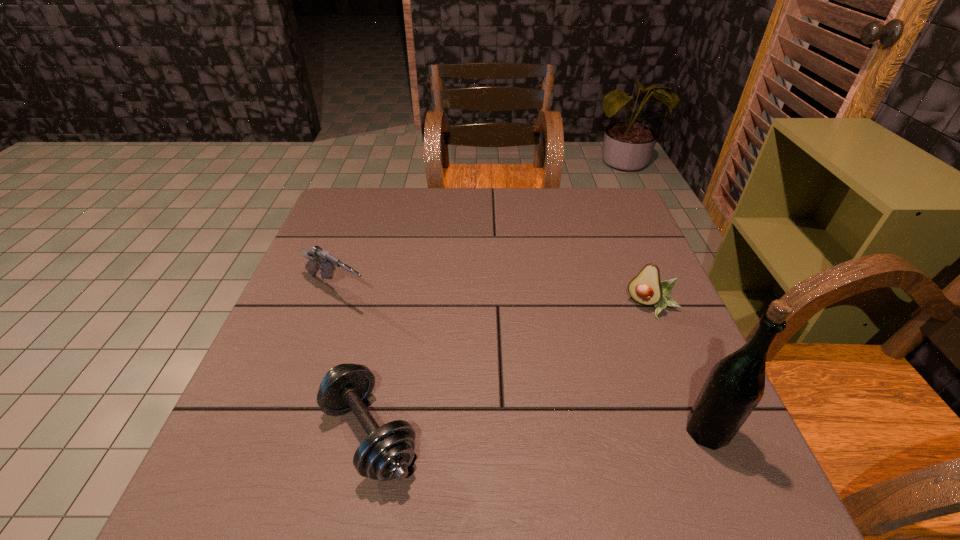
Where is `free region located on the seed side of the avocado`? This screenshot has height=540, width=960. free region located on the seed side of the avocado is located at coordinates (573, 436).

Locate an element on the screen. Image resolution: width=960 pixels, height=540 pixels. free location located 0.340m on the seed side of the avocado is located at coordinates (576, 432).

This screenshot has width=960, height=540. I want to click on dumbbell that is at the near edge, so click(x=385, y=454).

This screenshot has width=960, height=540. I want to click on beer bottle that is at the near edge, so click(x=735, y=385).

This screenshot has width=960, height=540. What are the coordinates of `object located in the left edge section of the desktop` in the screenshot? It's located at (318, 257).

Where is `beer bottle present at the right edge`? beer bottle present at the right edge is located at coordinates (735, 385).

Identify the location of avocado that is at the right edge. The height and width of the screenshot is (540, 960). (646, 288).

Where is `object positioned at the near right corner`? object positioned at the near right corner is located at coordinates (735, 385).

Locate an element on the screen. The height and width of the screenshot is (540, 960). vacant space at the far edge of the desktop is located at coordinates (391, 216).

This screenshot has height=540, width=960. What are the coordinates of `vacant region at the near edge of the desktop` in the screenshot? It's located at (532, 413).